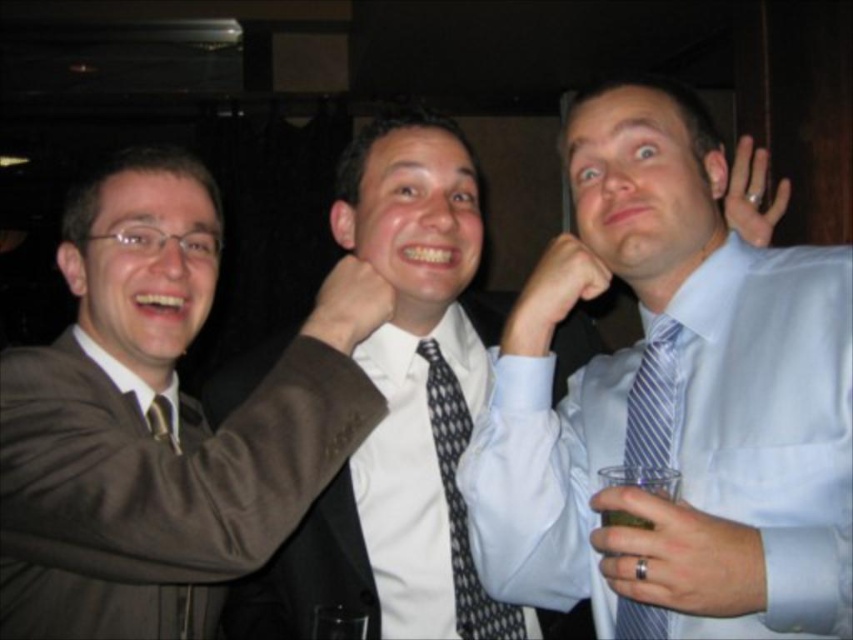
Between point (648, 554) and point (366, 316), which one is positioned in front?

Point (648, 554)

Locate an element on the screen. The width and height of the screenshot is (853, 640). blue striped tie at center is located at coordinates (672, 400).

Does matte black hand at center have a smaller size compared to matte skin hand at center?

Incorrect, matte black hand at center is not smaller in size than matte skin hand at center.

Describe the element at coordinates (552, 296) in the screenshot. This screenshot has height=640, width=853. I see `matte black hand at center` at that location.

The width and height of the screenshot is (853, 640). Find the location of `matte black hand at center`. matte black hand at center is located at coordinates (552, 296).

Does matte brown suit at left have a greater height compared to black dotted tie at center?

Yes.

Is matte brown suit at left positioned before black dotted tie at center?

That is True.

I want to click on matte brown suit at left, so click(152, 426).